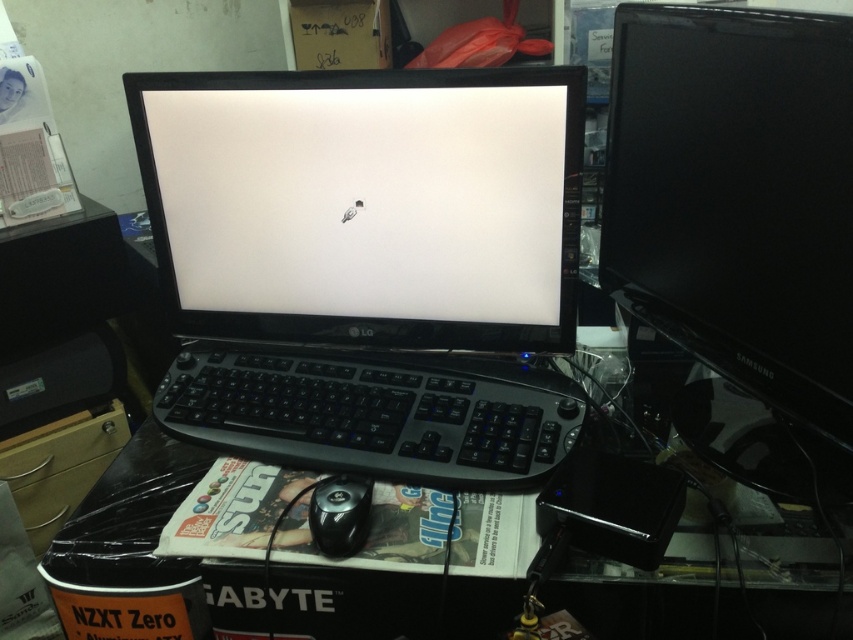
Find the location of a particular element. Image resolution: width=853 pixels, height=640 pixels. black plastic monitor at center is located at coordinates (367, 262).

Can you confirm if black plastic monitor at center is positioned above black plastic computer desk at center?

Yes.

Locate an element on the screen. This screenshot has width=853, height=640. black plastic monitor at center is located at coordinates (367, 262).

Does black glossy monitor at right have a larger size compared to black plastic mouse at center?

Correct, black glossy monitor at right is larger in size than black plastic mouse at center.

Between black glossy monitor at right and black plastic mouse at center, which one has less height?

black plastic mouse at center is shorter.

Does point (723, 244) come farther from viewer compared to point (338, 506)?

That is True.

Where is `black glossy monitor at right`? This screenshot has width=853, height=640. black glossy monitor at right is located at coordinates (737, 195).

Is black plastic computer desk at center closer to camera compared to black plastic mouse at center?

Yes, it is.

Who is positioned more to the left, black plastic computer desk at center or black plastic mouse at center?

black plastic mouse at center

Does point (704, 536) come closer to viewer compared to point (323, 502)?

No, it is not.

The image size is (853, 640). What are the coordinates of `black plastic computer desk at center` in the screenshot? It's located at (160, 532).